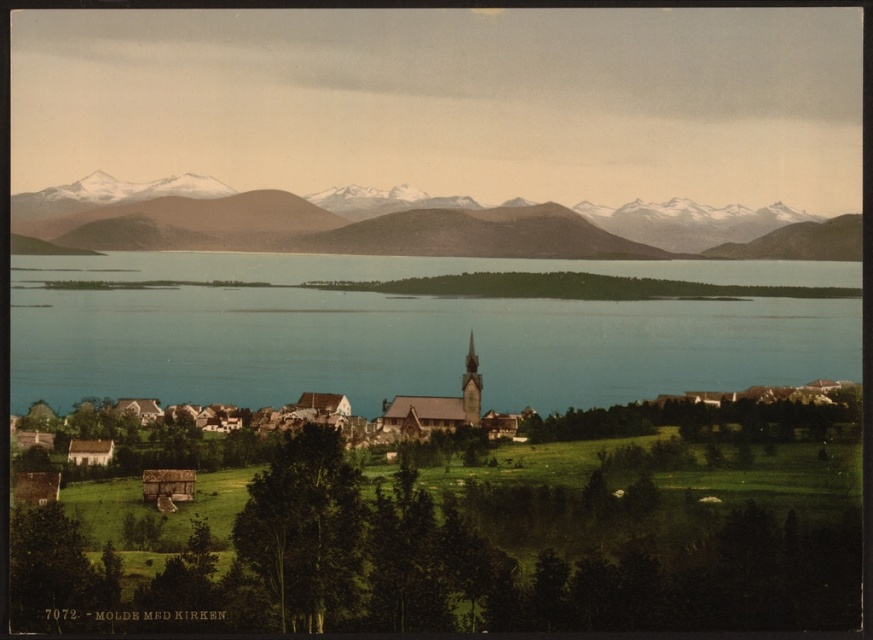
You are standing at the point marked as point (x=410, y=332) in the image. Looking around, you notice blue water at center. What is directly beneath your feet at this point?

The point (x=410, y=332) is directly above the blue water at center, so the blue water at center is beneath your feet.

You are standing at the point marked by coordinates point (x=410, y=332) in the image. What is the most likely feature of the landscape you are currently standing on?

The point (x=410, y=332) corresponds to blue water at center, so you are standing on the blue water at center.